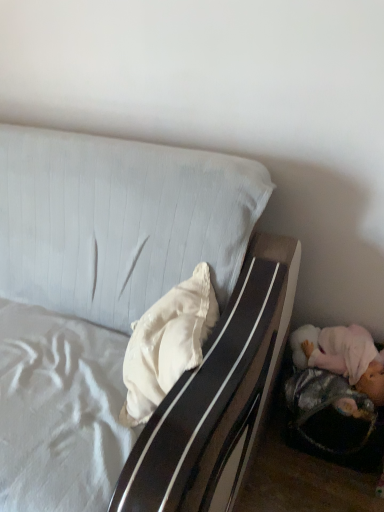
Question: Is white fabric bed at upper left placed right next to white satin pillow at center?

Choices:
 (A) no
 (B) yes

Answer: (A)

Question: Does white fabric bed at upper left turn towards white satin pillow at center?

Choices:
 (A) yes
 (B) no

Answer: (B)

Question: From a real-world perspective, is white fabric bed at upper left under white satin pillow at center?

Choices:
 (A) no
 (B) yes

Answer: (B)

Question: Is white satin pillow at center a part of white fabric bed at upper left?

Choices:
 (A) no
 (B) yes

Answer: (B)

Question: Is white fabric bed at upper left looking in the opposite direction of white satin pillow at center?

Choices:
 (A) yes
 (B) no

Answer: (A)

Question: Is white fabric bed at upper left wider than white satin pillow at center?

Choices:
 (A) no
 (B) yes

Answer: (B)

Question: Does white satin pillow at center have a greater height compared to white fabric bed at upper left?

Choices:
 (A) no
 (B) yes

Answer: (A)

Question: Can white fabric bed at upper left be found inside white satin pillow at center?

Choices:
 (A) no
 (B) yes

Answer: (A)

Question: Would you say white satin pillow at center is outside white fabric bed at upper left?

Choices:
 (A) yes
 (B) no

Answer: (B)

Question: Is the position of white satin pillow at center less distant than that of white fabric bed at upper left?

Choices:
 (A) yes
 (B) no

Answer: (B)

Question: Does white satin pillow at center turn towards white fabric bed at upper left?

Choices:
 (A) yes
 (B) no

Answer: (A)

Question: Is white satin pillow at center next to white fabric bed at upper left and touching it?

Choices:
 (A) yes
 (B) no

Answer: (B)

Question: From their relative heights in the image, would you say white satin pillow at center is taller or shorter than white fabric bed at upper left?

Choices:
 (A) short
 (B) tall

Answer: (A)